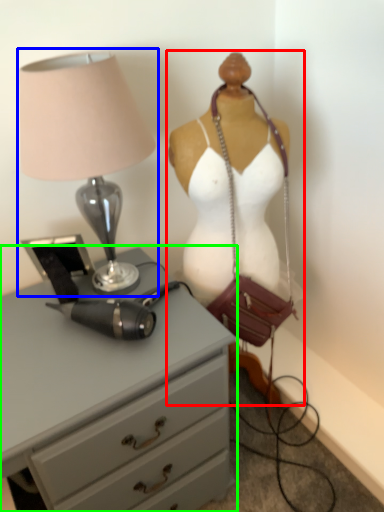
Question: Based on their relative distances, which object is nearer to mannequin (highlighted by a red box)? Choose from lamp (highlighted by a blue box) and chest of drawers (highlighted by a green box).

Choices:
 (A) lamp
 (B) chest of drawers

Answer: (A)